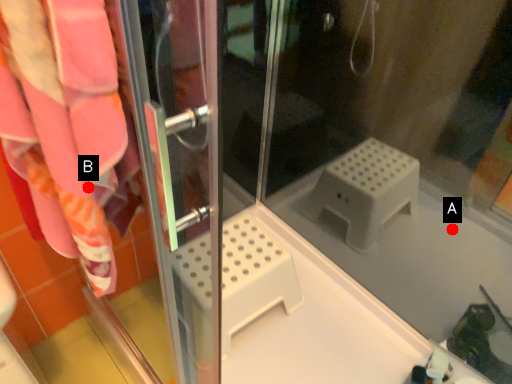
Question: Two points are circled on the image, labeled by A and B beside each circle. Which point is farther to the camera?

Choices:
 (A) A is further
 (B) B is further

Answer: (A)